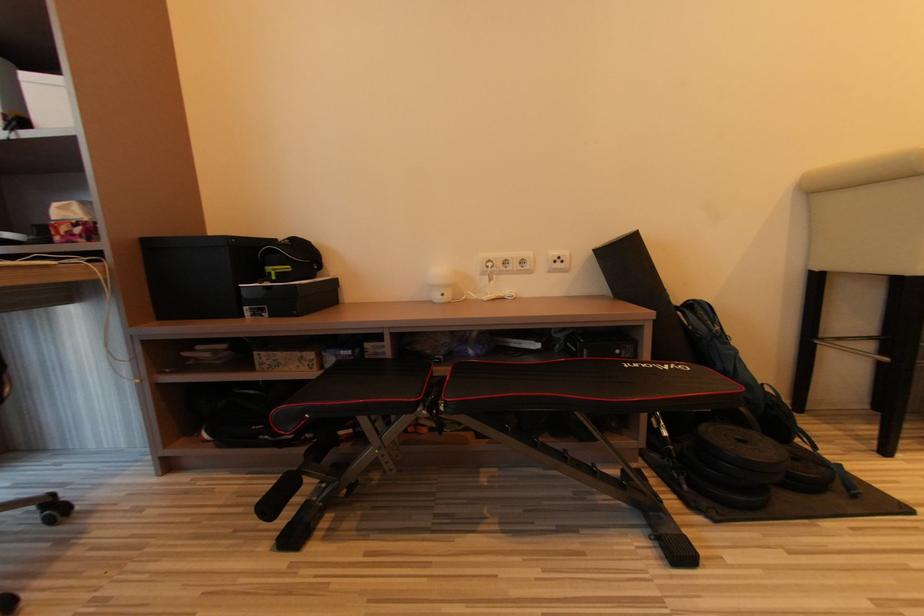
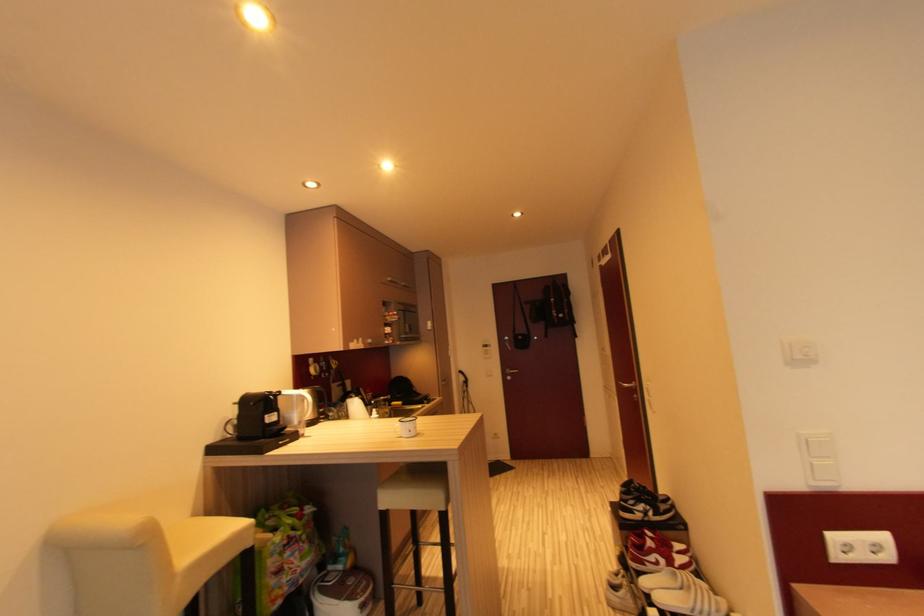
Question: The first image is from the beginning of the video and the second image is from the end. How did the camera likely rotate when shooting the video?

Choices:
 (A) Left
 (B) Right
 (C) Up
 (D) Down

Answer: (B)